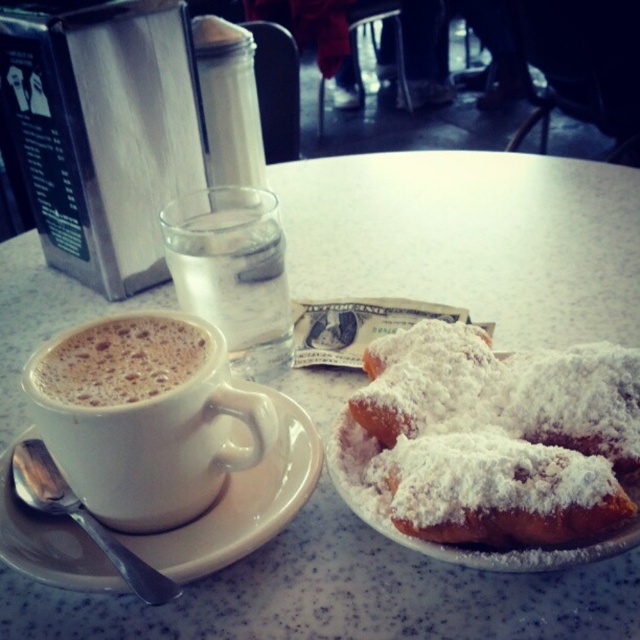
Who is higher up, powdery golden pastry at lower right or white frothy coffee at upper left?

white frothy coffee at upper left is above.

Is powdery golden pastry at lower right wider than white frothy coffee at upper left?

Indeed, powdery golden pastry at lower right has a greater width compared to white frothy coffee at upper left.

Locate an element on the screen. The height and width of the screenshot is (640, 640). powdery golden pastry at lower right is located at coordinates (499, 436).

Which is below, clear glass water at upper center or white frothy coffee at upper left?

white frothy coffee at upper left

Is clear glass water at upper center to the right of white frothy coffee at upper left from the viewer's perspective?

Yes, clear glass water at upper center is to the right of white frothy coffee at upper left.

Locate an element on the screen. This screenshot has height=640, width=640. clear glass water at upper center is located at coordinates (234, 273).

I want to click on clear glass water at upper center, so click(x=234, y=273).

Is white matte cup at left wider than white ceramic saucer at left?

No.

Is point (220, 412) closer to camera compared to point (250, 388)?

Yes, it is in front of point (250, 388).

Looking at this image, who is more distant from viewer, (28, 394) or (308, 480)?

Point (308, 480)

You are a GUI agent. You are given a task and a screenshot of the screen. Output one action in this format:
    pyautogui.click(x=<x>, y=<y>)
    Task: Click on the white matte cup at left
    
    Given the screenshot: What is the action you would take?
    pyautogui.click(x=145, y=417)